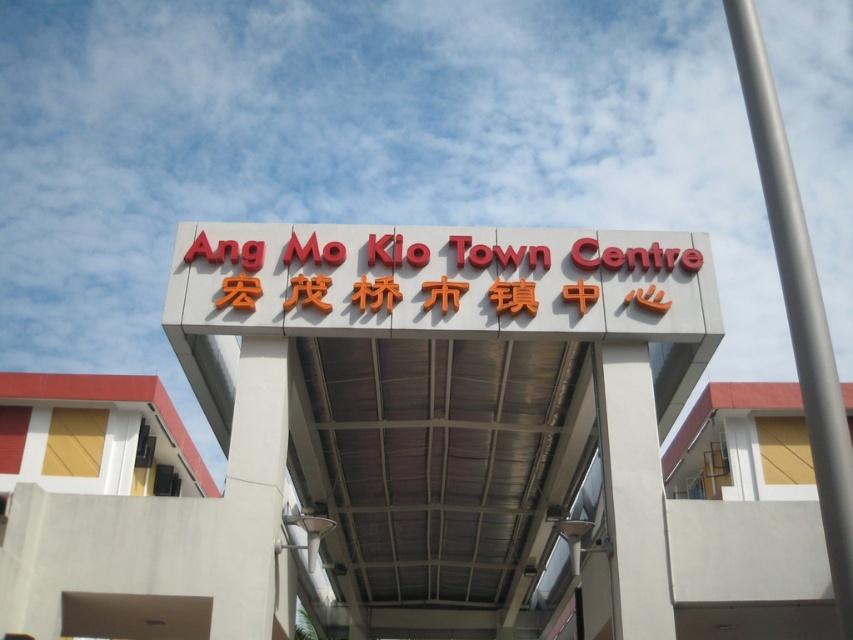
Question: Observing the image, what is the correct spatial positioning of silver metallic pole at upper right in reference to red plastic sign at center?

Choices:
 (A) right
 (B) left

Answer: (A)

Question: Which point is closer to the camera taking this photo?

Choices:
 (A) (813, 406)
 (B) (222, 259)
 (C) (572, 481)

Answer: (A)

Question: Does white matte sign at center have a lesser width compared to silver metallic pole at upper right?

Choices:
 (A) yes
 (B) no

Answer: (B)

Question: Which point is farther from the camera taking this photo?

Choices:
 (A) (250, 268)
 (B) (849, 464)
 (C) (648, 362)

Answer: (A)

Question: Is silver metallic pole at upper right thinner than red plastic sign at center?

Choices:
 (A) no
 (B) yes

Answer: (A)

Question: Which object is the closest to the white matte sign at center?

Choices:
 (A) silver metallic pole at upper right
 (B) red plastic sign at center

Answer: (B)